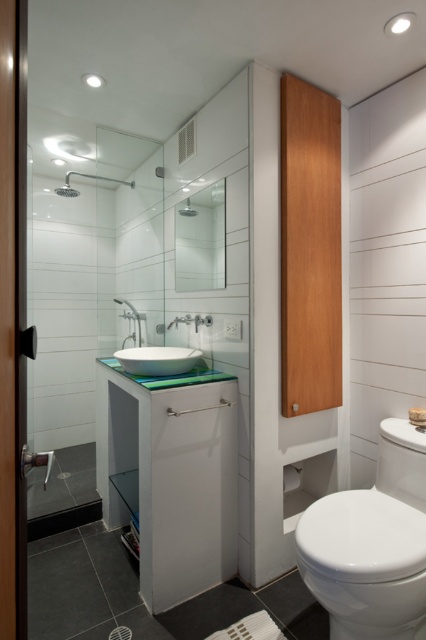
Describe the element at coordinates (371, 545) in the screenshot. I see `white glossy toilet at lower right` at that location.

Is the position of white glossy toilet at lower right less distant than that of matte glass shower at upper center?

Yes, it is.

The width and height of the screenshot is (426, 640). I want to click on white glossy toilet at lower right, so click(371, 545).

Between green glass vanity at center and white glossy faucet at upper center, which one has more height?

green glass vanity at center is taller.

Does green glass vanity at center appear over white glossy faucet at upper center?

Actually, green glass vanity at center is below white glossy faucet at upper center.

The width and height of the screenshot is (426, 640). Describe the element at coordinates (169, 476) in the screenshot. I see `green glass vanity at center` at that location.

What are the coordinates of `green glass vanity at center` in the screenshot? It's located at (169, 476).

Between white glossy toilet at lower right and white glossy faucet at upper center, which one has less height?

With less height is white glossy faucet at upper center.

Is white glossy toilet at lower right further to camera compared to white glossy faucet at upper center?

No, white glossy toilet at lower right is closer to the viewer.

Is point (380, 440) closer to camera compared to point (134, 332)?

Yes.

I want to click on white glossy toilet at lower right, so click(371, 545).